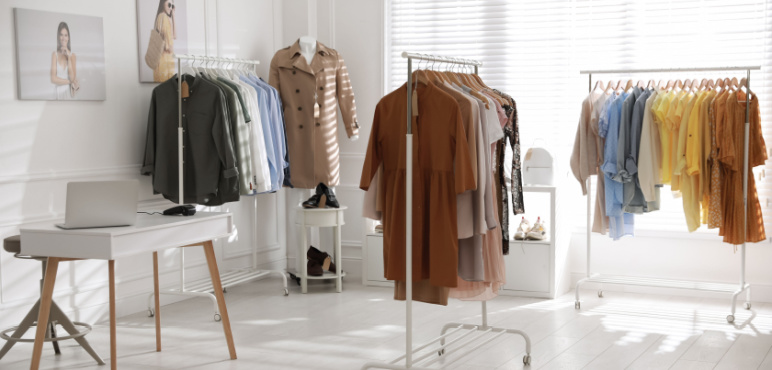
Find the location of a particular element. Image resolution: width=772 pixels, height=370 pixels. shelves is located at coordinates (330, 219), (329, 277), (300, 186), (547, 194), (536, 260).